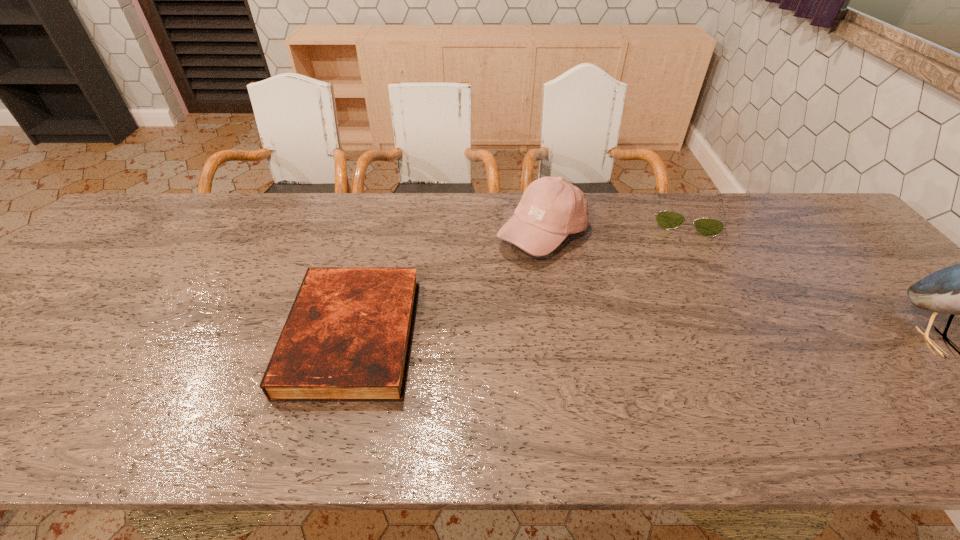
Choose which object is the third nearest neighbor to the second object from right to left. Please provide its 2D coordinates. Your answer should be formatted as a tuple, i.e. [(x, y)], where the tuple contains the x and y coordinates of a point satisfying the conditions above.

[(347, 338)]

Locate an element on the screen. The height and width of the screenshot is (540, 960). object that ranks as the closest to the tallest object is located at coordinates (708, 227).